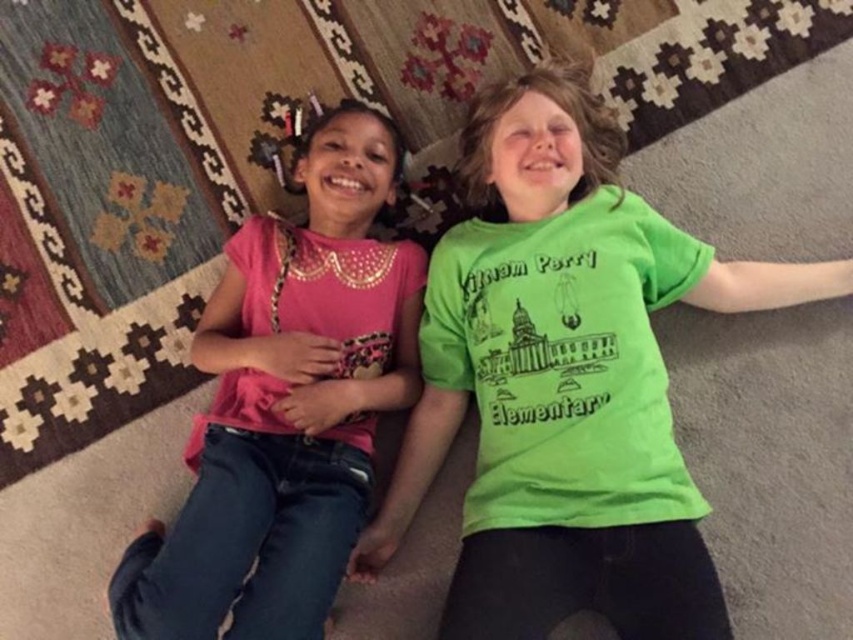
Question: Is green matte shirt at center to the right of pink satin shirt at left from the viewer's perspective?

Choices:
 (A) yes
 (B) no

Answer: (A)

Question: Considering the relative positions of green matte shirt at center and pink satin shirt at left in the image provided, where is green matte shirt at center located with respect to pink satin shirt at left?

Choices:
 (A) above
 (B) below

Answer: (A)

Question: Which of the following is the closest to the observer?

Choices:
 (A) pink satin shirt at left
 (B) green matte shirt at center

Answer: (A)

Question: Which point appears closest to the camera in this image?

Choices:
 (A) (283, 289)
 (B) (500, 268)

Answer: (B)

Question: Which point appears farthest from the camera in this image?

Choices:
 (A) (349, 444)
 (B) (437, 252)

Answer: (B)

Question: Is green matte shirt at center further to the viewer compared to pink satin shirt at left?

Choices:
 (A) no
 (B) yes

Answer: (B)